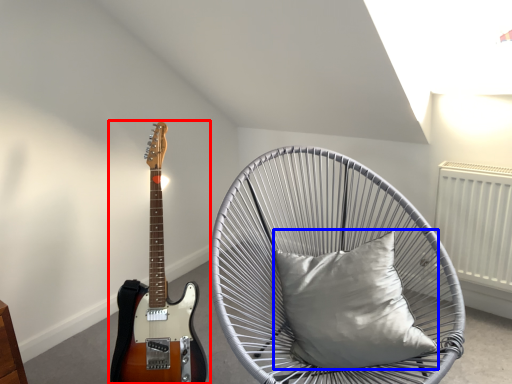
Question: Which object is further to the camera taking this photo, guitar (highlighted by a red box) or pillow (highlighted by a blue box)?

Choices:
 (A) guitar
 (B) pillow

Answer: (B)